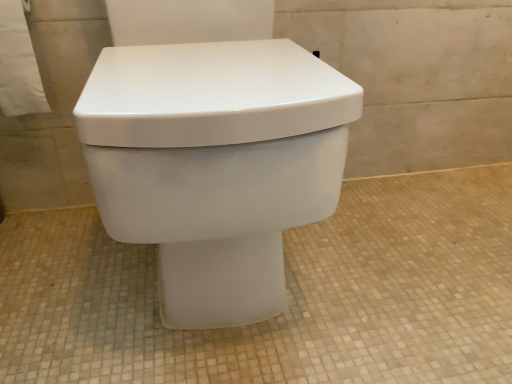
Question: Is white paper towel at upper left smaller than white glossy toilet at center?

Choices:
 (A) no
 (B) yes

Answer: (B)

Question: From the image's perspective, does white paper towel at upper left appear higher than white glossy toilet at center?

Choices:
 (A) no
 (B) yes

Answer: (B)

Question: Can you confirm if white paper towel at upper left is positioned to the right of white glossy toilet at center?

Choices:
 (A) no
 (B) yes

Answer: (A)

Question: Is white paper towel at upper left bigger than white glossy toilet at center?

Choices:
 (A) no
 (B) yes

Answer: (A)

Question: From the image's perspective, would you say white paper towel at upper left is shown under white glossy toilet at center?

Choices:
 (A) no
 (B) yes

Answer: (A)

Question: Do you think white glossy toilet at center is within white matte toilet at center, or outside of it?

Choices:
 (A) inside
 (B) outside

Answer: (B)

Question: From their relative heights in the image, would you say white glossy toilet at center is taller or shorter than white matte toilet at center?

Choices:
 (A) tall
 (B) short

Answer: (A)

Question: Is point (330, 208) positioned closer to the camera than point (420, 360)?

Choices:
 (A) closer
 (B) farther

Answer: (A)

Question: Is white glossy toilet at center bigger or smaller than white matte toilet at center?

Choices:
 (A) small
 (B) big

Answer: (B)

Question: From a real-world perspective, is white paper towel at upper left above or below white glossy toilet at center?

Choices:
 (A) above
 (B) below

Answer: (A)

Question: Is white paper towel at upper left wider or thinner than white glossy toilet at center?

Choices:
 (A) thin
 (B) wide

Answer: (A)

Question: From the image's perspective, is white paper towel at upper left positioned above or below white glossy toilet at center?

Choices:
 (A) above
 (B) below

Answer: (A)

Question: In terms of height, does white paper towel at upper left look taller or shorter compared to white glossy toilet at center?

Choices:
 (A) tall
 (B) short

Answer: (B)

Question: In the image, is white glossy toilet at center on the left side or the right side of white paper towel at upper left?

Choices:
 (A) left
 (B) right

Answer: (B)

Question: From their relative heights in the image, would you say white glossy toilet at center is taller or shorter than white paper towel at upper left?

Choices:
 (A) tall
 (B) short

Answer: (A)